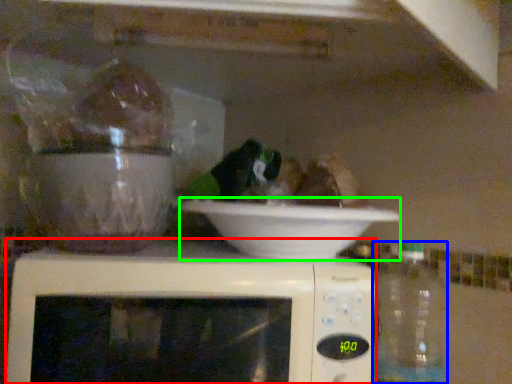
Question: Which object is positioned farthest from microwave oven (highlighted by a red box)? Select from bottle (highlighted by a blue box) and bowl (highlighted by a green box).

Choices:
 (A) bottle
 (B) bowl

Answer: (A)